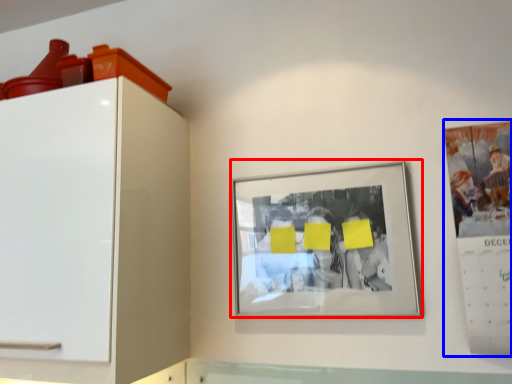
Question: Which object appears farthest to the camera in this image, picture frame (highlighted by a red box) or poster (highlighted by a blue box)?

Choices:
 (A) picture frame
 (B) poster

Answer: (A)